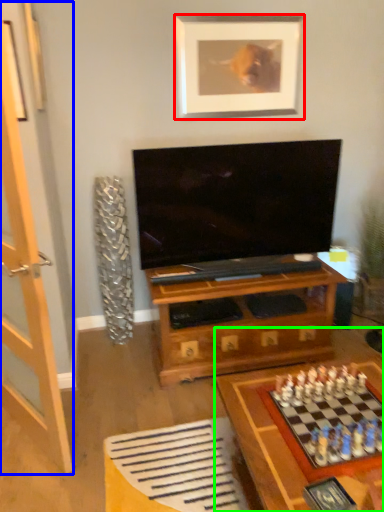
Question: Based on their relative distances, which object is nearer to picture frame (highlighted by a red box)? Choose from glass door (highlighted by a blue box) and table (highlighted by a green box).

Choices:
 (A) glass door
 (B) table

Answer: (A)